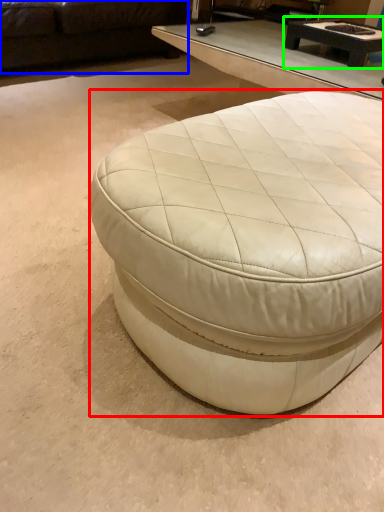
Question: Which is farther away from coffee table (highlighted by a red box)? studio couch (highlighted by a blue box) or coffee table (highlighted by a green box)?

Choices:
 (A) studio couch
 (B) coffee table

Answer: (A)